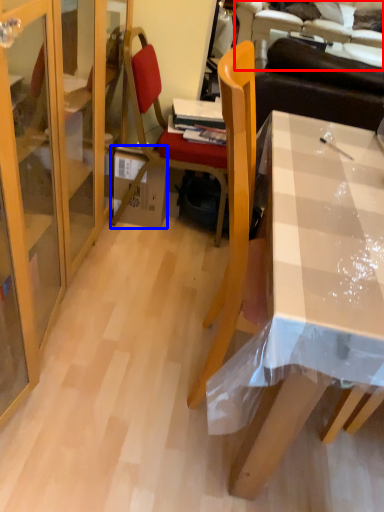
Question: Which object is further to the camera taking this photo, couch (highlighted by a red box) or box (highlighted by a blue box)?

Choices:
 (A) couch
 (B) box

Answer: (A)